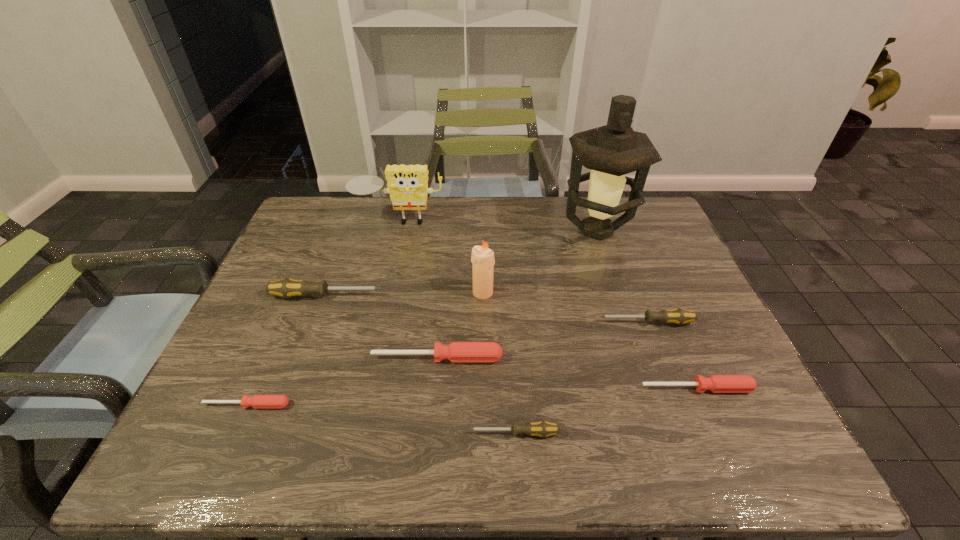
Where is `vacant space in between the biggest red screwdriver and the biggest gray screwdriver`? Image resolution: width=960 pixels, height=540 pixels. vacant space in between the biggest red screwdriver and the biggest gray screwdriver is located at coordinates (382, 327).

Locate an element on the screen. This screenshot has width=960, height=540. empty space that is in between the candle and the rightmost gray screwdriver is located at coordinates (564, 308).

Find the location of `blank region between the nearest gray screwdriver and the second smallest gray screwdriver`. blank region between the nearest gray screwdriver and the second smallest gray screwdriver is located at coordinates (580, 378).

Identify the location of vacant area that lies between the oil lamp and the candle. (540, 262).

Locate an element on the screen. The width and height of the screenshot is (960, 540). vacant point located between the sponge and the fourth farthest screwdriver is located at coordinates (548, 304).

This screenshot has height=540, width=960. I want to click on blank region between the rightmost red screwdriver and the second red screwdriver from left to right, so click(x=566, y=373).

Image resolution: width=960 pixels, height=540 pixels. Identify the location of blank region between the candle and the sponge. (442, 256).

The image size is (960, 540). I want to click on free point between the candle and the second nearest red screwdriver, so [x=589, y=341].

The image size is (960, 540). Identify the location of object that stands as the closest to the smallest gray screwdriver. (456, 351).

This screenshot has width=960, height=540. Find the location of `object that is the closest one to the fourth nearest screwdriver`. object that is the closest one to the fourth nearest screwdriver is located at coordinates (543, 429).